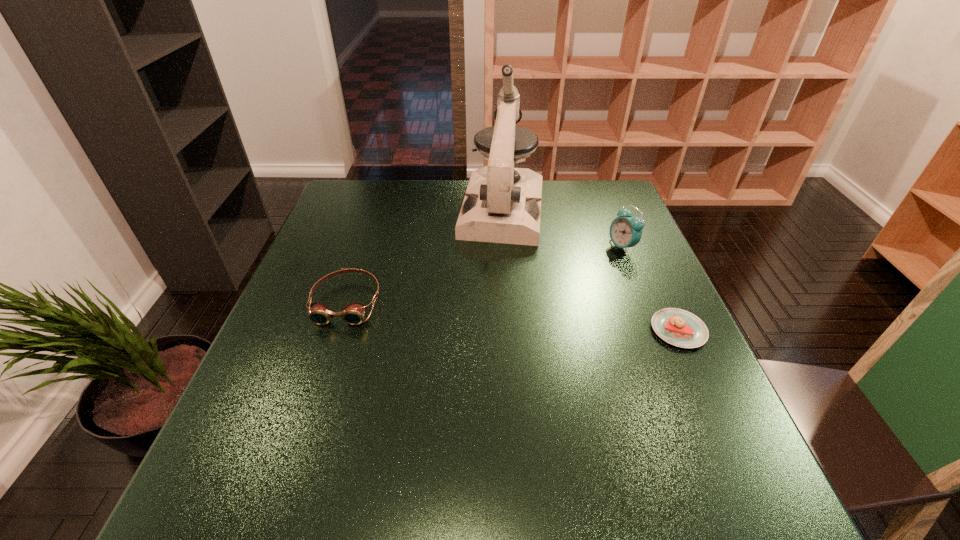
The height and width of the screenshot is (540, 960). In order to click on vacant space at the left edge of the desktop in this screenshot , I will do `click(270, 360)`.

At what (x,y) coordinates should I click in order to perform the action: click on vacant point at the right edge. Please return your answer as a coordinate pair (x, y). Looking at the image, I should click on pos(598,241).

Identify the location of vacant space at the near left corner of the desktop. This screenshot has width=960, height=540. (253, 414).

Where is `blank space at the far right corner of the desktop`? blank space at the far right corner of the desktop is located at coordinates (612, 220).

Identify the location of vacant area between the pastry and the second object from left to right. (590, 271).

You are a GUI agent. You are given a task and a screenshot of the screen. Output one action in this format:
    pyautogui.click(x=<x>, y=<y>)
    Task: Click on the empty space between the third shortest object and the shortest object
    This screenshot has height=540, width=960.
    Given the screenshot: What is the action you would take?
    pyautogui.click(x=650, y=288)

What are the coordinates of `free space between the tallest object and the pastry` in the screenshot? It's located at (590, 271).

Find the location of a particular element. empty space between the pastry and the second object from left to right is located at coordinates (590, 271).

This screenshot has width=960, height=540. Identify the location of free space that is in between the tallest object and the alarm clock. (562, 229).

What are the coordinates of `free space between the alarm clock and the pastry` in the screenshot? It's located at (650, 288).